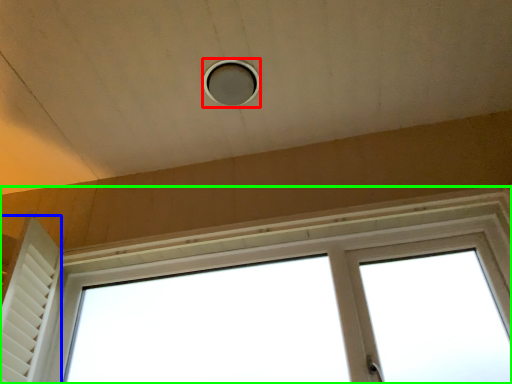
Question: Estimate the real-world distances between objects in this image. Which object is closer to hole (highlighted by a red box), shutter (highlighted by a blue box) or window (highlighted by a green box)?

Choices:
 (A) shutter
 (B) window

Answer: (B)